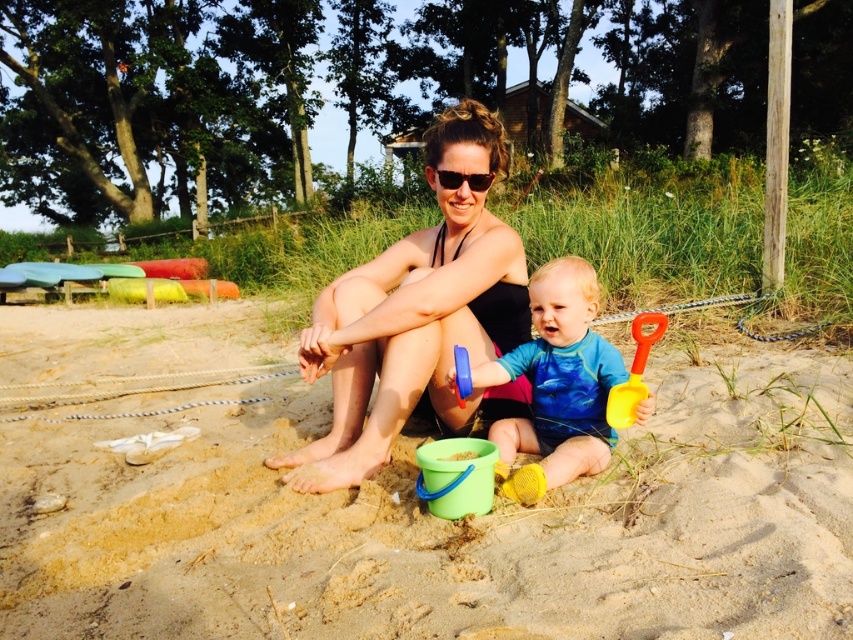
Can you confirm if black matte swimsuit at center is smaller than black plastic sunglasses at center?

Incorrect, black matte swimsuit at center is not smaller in size than black plastic sunglasses at center.

Is point (457, 301) positioned after point (450, 184)?

That is False.

Locate an element on the screen. The height and width of the screenshot is (640, 853). black matte swimsuit at center is located at coordinates (416, 316).

Which is more to the left, blue rubber toy at center or black plastic sunglasses at center?

black plastic sunglasses at center

Which is behind, point (560, 307) or point (486, 180)?

The point (486, 180) is more distant.

Between point (537, 472) and point (490, 177), which one is positioned in front?

Point (537, 472) is in front.

You are a GUI agent. You are given a task and a screenshot of the screen. Output one action in this format:
    pyautogui.click(x=<x>, y=<y>)
    Task: Click on the blue rubber toy at center
    The height and width of the screenshot is (640, 853).
    Given the screenshot: What is the action you would take?
    pyautogui.click(x=556, y=385)

Is yellow plastic shovel at lower right positioned behind blue plastic bucket at center?

No, it is not.

This screenshot has width=853, height=640. I want to click on yellow plastic shovel at lower right, so click(x=634, y=371).